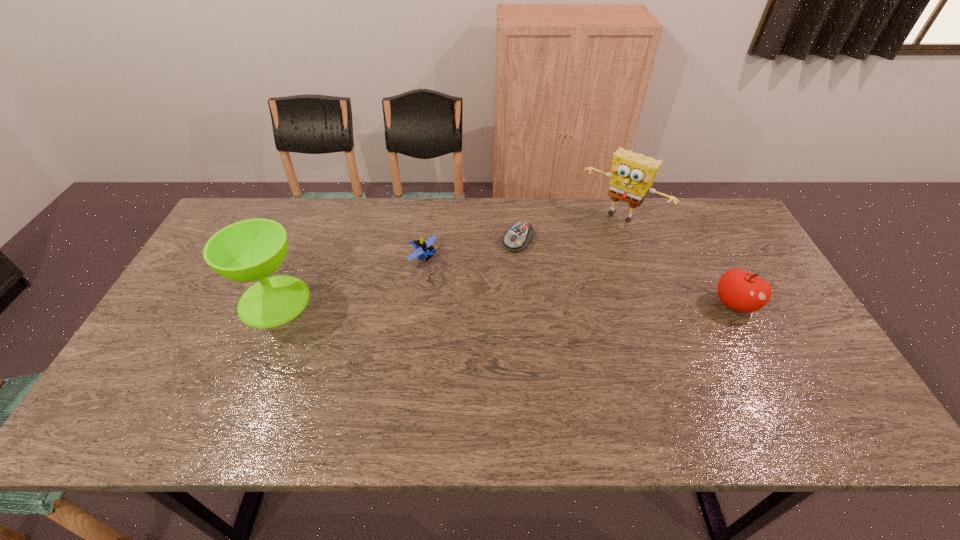
Identify the location of free space that satisfies the following two spatial constraints: 1. on the front side of the sponge; 2. on the left side of the rightmost object. (652, 305).

The image size is (960, 540). I want to click on vacant region that satisfies the following two spatial constraints: 1. on the back side of the second shortest object; 2. on the left side of the wineglass, so click(294, 256).